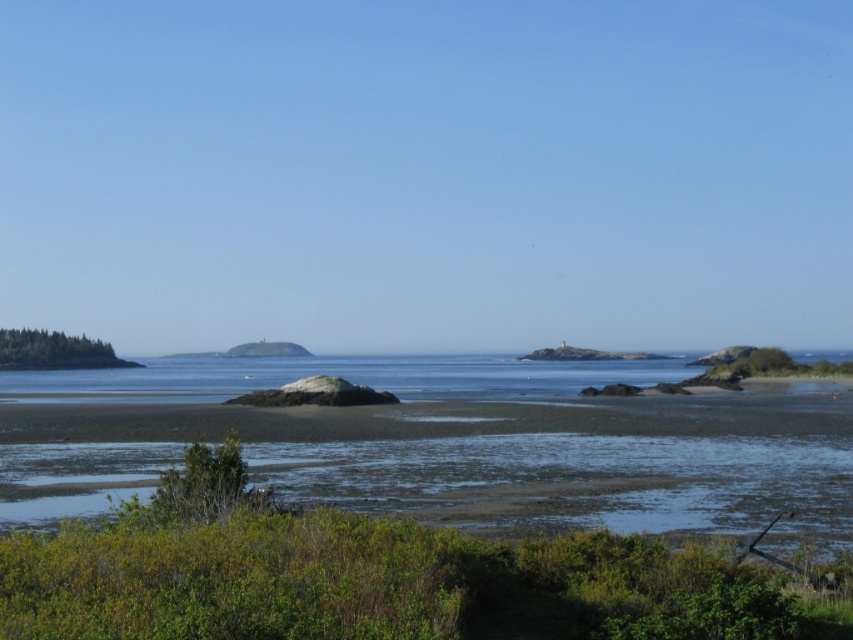
Question: Estimate the real-world distances between objects in this image. Which object is farther from the clear blue water at center?

Choices:
 (A) green grassy beach at lower center
 (B) green grassy island at left

Answer: (B)

Question: Is clear blue water at center closer to the viewer compared to green grassy island at left?

Choices:
 (A) yes
 (B) no

Answer: (A)

Question: Does green grassy beach at lower center have a smaller size compared to green grassy island at left?

Choices:
 (A) no
 (B) yes

Answer: (A)

Question: Which is nearer to the clear blue water at center?

Choices:
 (A) green grassy beach at lower center
 (B) green grassy island at left

Answer: (A)

Question: Among these points, which one is nearest to the camera?

Choices:
 (A) (683, 372)
 (B) (782, 442)

Answer: (B)

Question: Does green grassy beach at lower center appear under clear blue water at center?

Choices:
 (A) no
 (B) yes

Answer: (A)